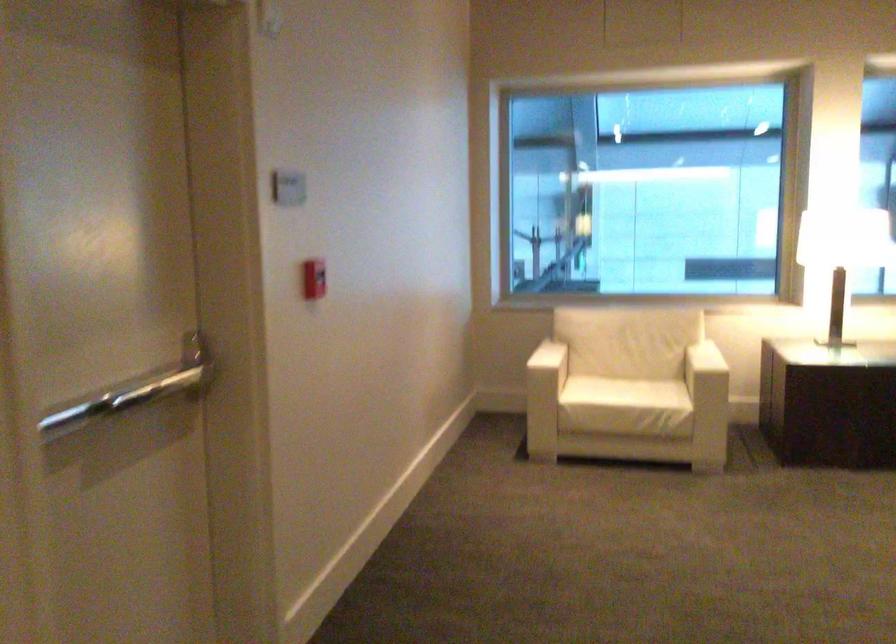
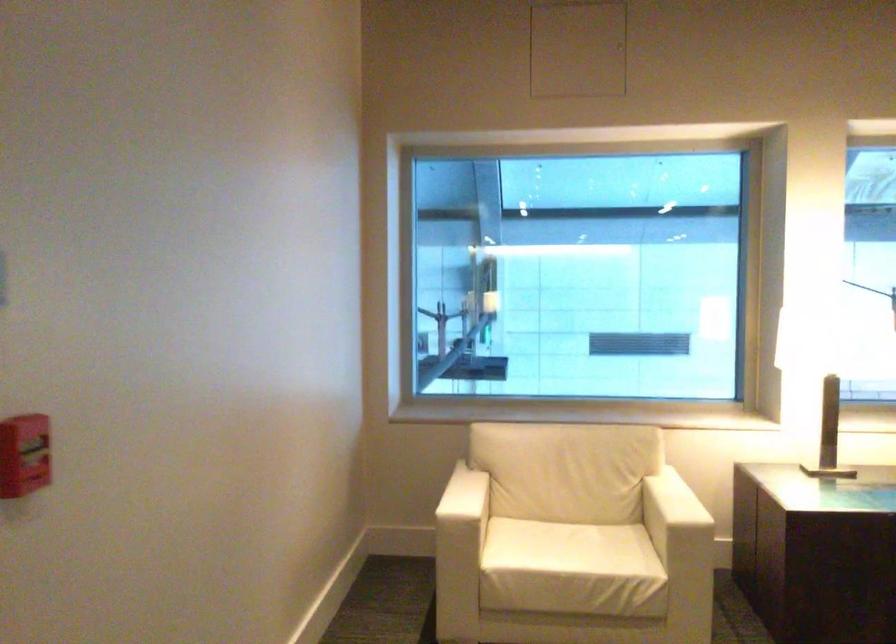
Where in the second image is the point corresponding to the point at 705,355 from the first image?

(673, 504)